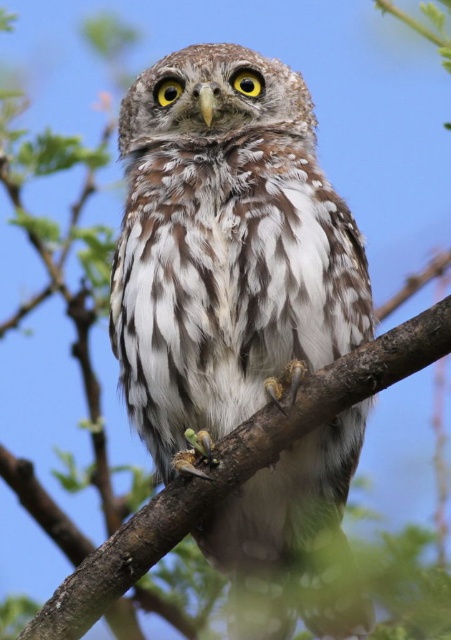
Which is above, brown feathered owl at center or brown textured branch at center?

brown feathered owl at center

Does brown feathered owl at center appear under brown textured branch at center?

No.

Between point (159, 422) and point (175, 493), which one is positioned in front?

Point (175, 493)

Where is `brown feathered owl at center`? brown feathered owl at center is located at coordinates (225, 248).